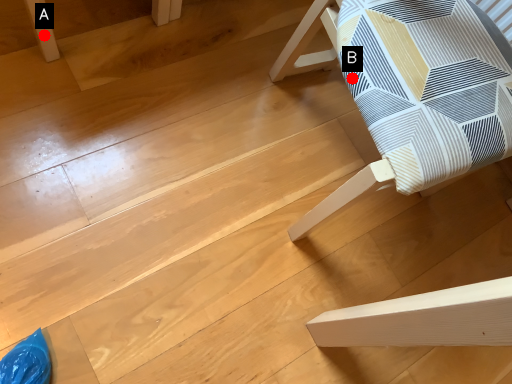
Question: Two points are circled on the image, labeled by A and B beside each circle. Which point is further to the camera?

Choices:
 (A) A is further
 (B) B is further

Answer: (A)